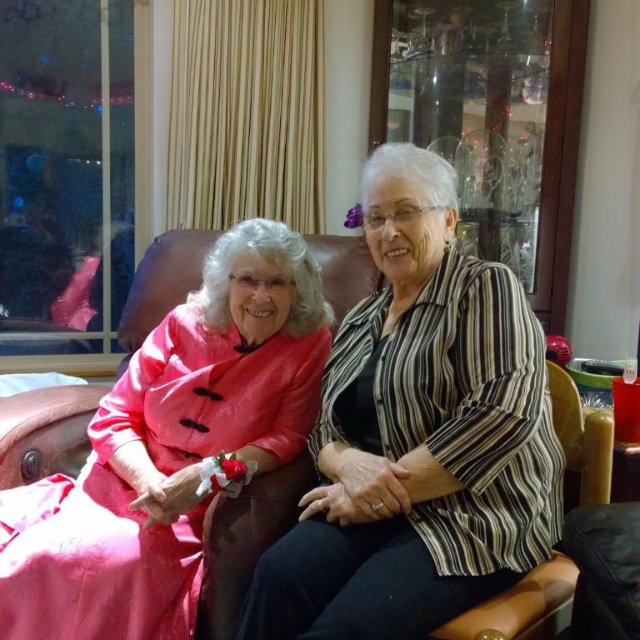
You are an interior designer assessing the layout of this living room. You notice the striped fabric shirt at center and the matte pink dress at left. Which object is positioned higher in the image?

The striped fabric shirt at center is positioned higher in the image than the matte pink dress at left according to the description.

You are standing in the living room and want to take a photo of the point at coordinates point (396,620). The camera has a focal length of 50mm and a sensor size of 24mm. What is the minimum distance you need to move forward or backward to ensure the point is in focus?

The point (396,620) is 1.00 meters from the camera. To ensure it is in focus, you need to adjust your distance to match the focal length and sensor size. Since the sensor size is 24mm and focal length is 50mm, the minimum distance required for focus is calculated using the formula distance > focal length multiplied by sensor size divided by subject size. However, without knowing the subject size at that point, it is impossible to determine the exact adjustment. Therefore, you should move closer until the

You are a photographer adjusting the lighting in the room. You notice a point at coordinates (419,435) on the image. Based on the scene description, what object is located at this point?

The point at coordinates (419,435) corresponds to the striped fabric shirt at center.